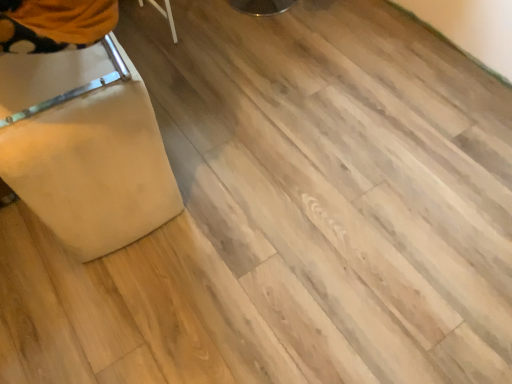
You are a GUI agent. You are given a task and a screenshot of the screen. Output one action in this format:
    pyautogui.click(x=<x>, y=<y>)
    Task: Click on the vacant area that is in front of beige fabric ottoman at lower left
    The width and height of the screenshot is (512, 384).
    Given the screenshot: What is the action you would take?
    pyautogui.click(x=88, y=283)